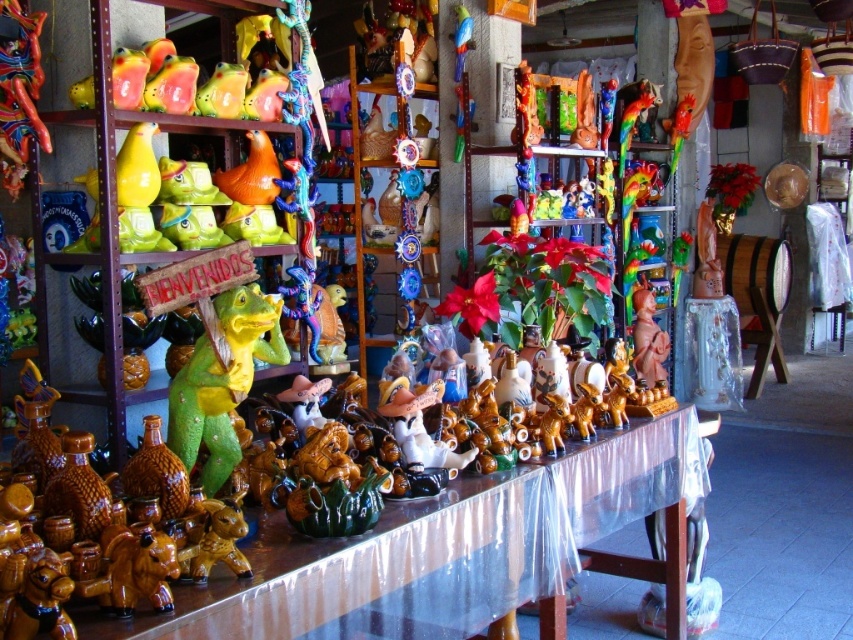
Who is lower down, matte ceramic table at center or green matte dinosaur at center?

matte ceramic table at center

Where is `matte ceramic table at center`? matte ceramic table at center is located at coordinates (448, 548).